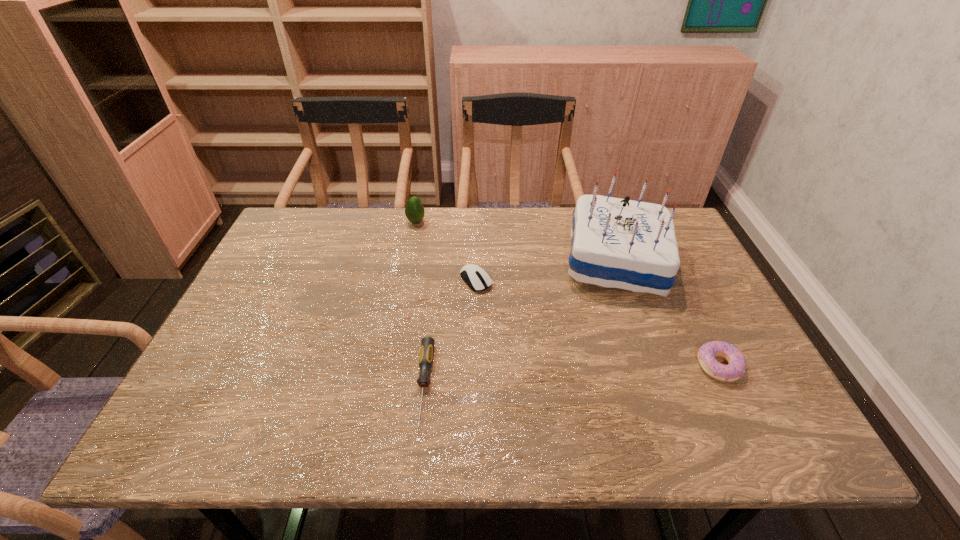
Where is `birthday cake`? The height and width of the screenshot is (540, 960). birthday cake is located at coordinates (616, 243).

You are a GUI agent. You are given a task and a screenshot of the screen. Output one action in this format:
    pyautogui.click(x=<x>, y=<y>)
    Task: Click on the farthest object
    
    Given the screenshot: What is the action you would take?
    pyautogui.click(x=414, y=210)

Locate an element on the screen. This screenshot has width=960, height=540. avocado is located at coordinates (414, 210).

Identify the location of doughnut. The height and width of the screenshot is (540, 960). (736, 368).

Where is `the third object from left to right`? the third object from left to right is located at coordinates (475, 277).

Identify the location of the fourth object from right to left. (427, 344).

Where is `screwdriver`? This screenshot has height=540, width=960. screwdriver is located at coordinates (427, 344).

Locate an element on the screen. The image size is (960, 540). blank area located 0.240m on the left of the tallest object is located at coordinates (x=478, y=261).

Locate an element on the screen. The width and height of the screenshot is (960, 540). free space located on the right of the fourth shortest object is located at coordinates (450, 222).

In order to click on free space located on the back of the doughnut in this screenshot , I will do `click(674, 273)`.